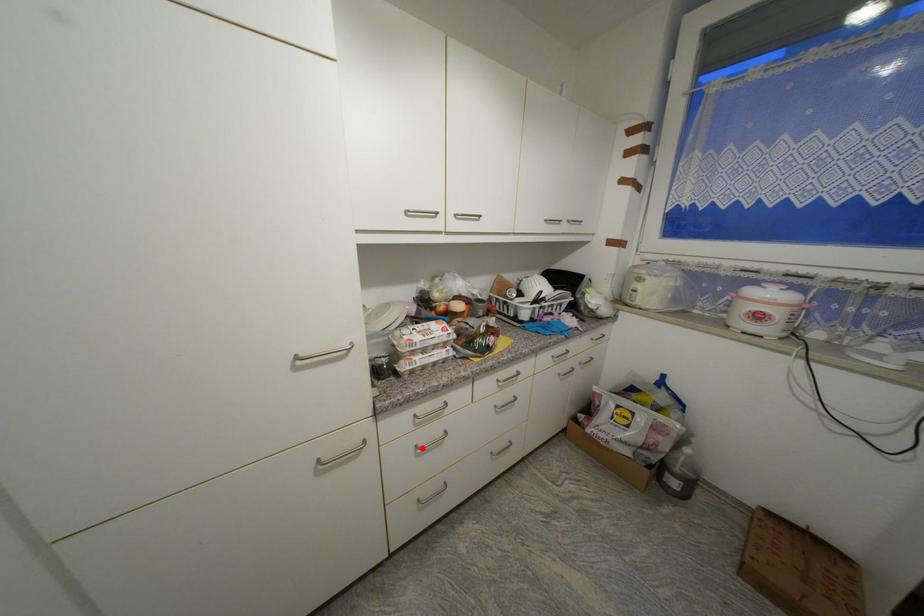
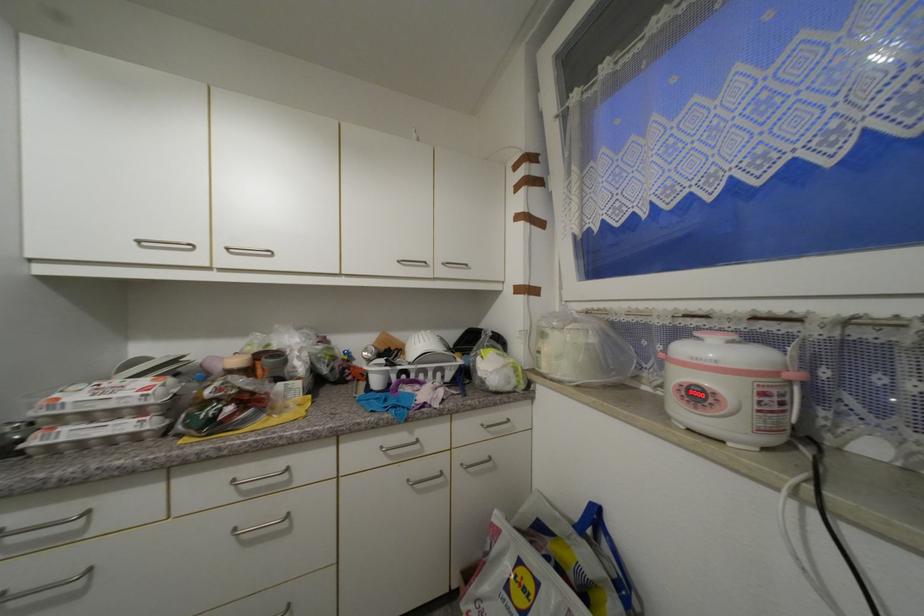
Question: I am providing you with two images of the same scene from different viewpoints. Image1 has a red point marked. In image2, the corresponding 3D location appears at what relative position? Reply with the corresponding letter.

Choices:
 (A) Closer
 (B) Farther

Answer: (A)